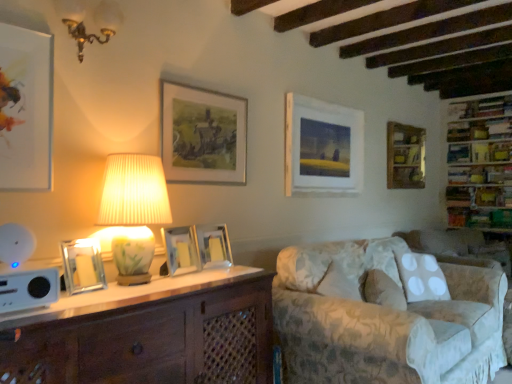
You are a GUI agent. You are given a task and a screenshot of the screen. Output one action in this format:
    pyautogui.click(x=<x>, y=<y>)
    Task: Click on the vacant area located to the right-hand side of white pleated fabric lampshade at upper left, which is counted as the first lamp, starting from the bottom
    This screenshot has height=384, width=512.
    Given the screenshot: What is the action you would take?
    pyautogui.click(x=190, y=284)